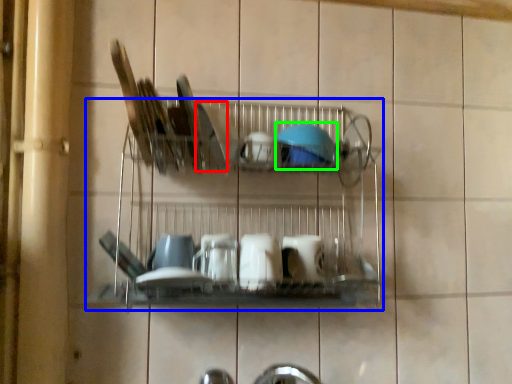
Question: Estimate the real-world distances between objects in this image. Which object is closer to tableware (highlighted by a red box), shelf (highlighted by a blue box) or tableware (highlighted by a green box)?

Choices:
 (A) shelf
 (B) tableware

Answer: (B)